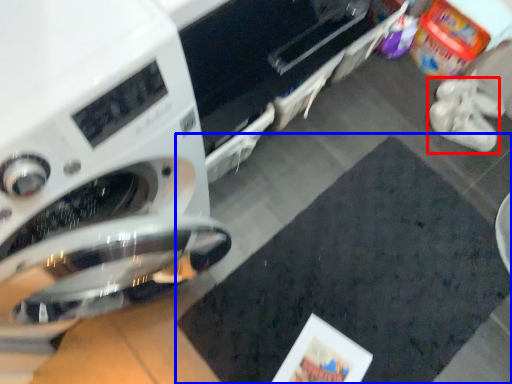
Question: Which object is closer to the camera taking this photo, footwear (highlighted by a red box) or mat (highlighted by a blue box)?

Choices:
 (A) footwear
 (B) mat

Answer: (B)